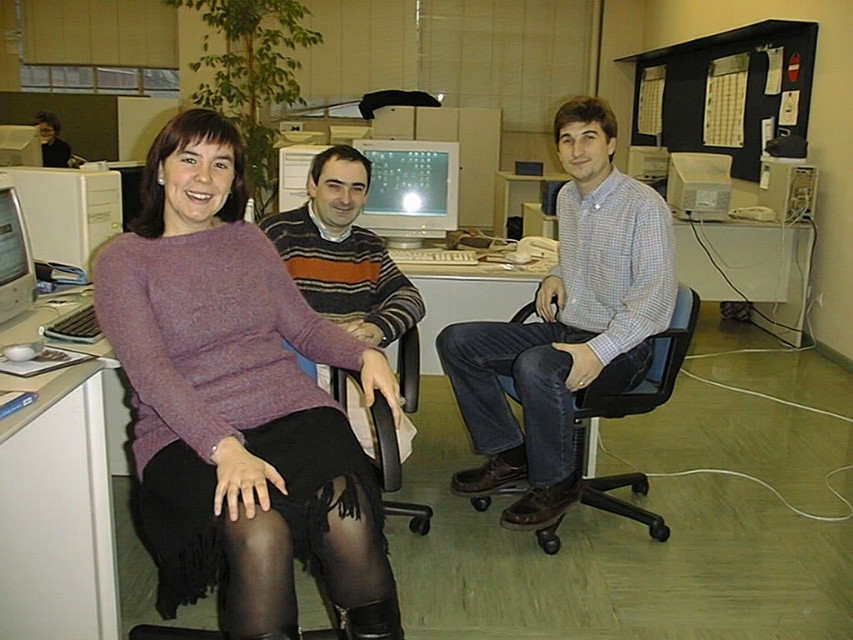
You are a delivery person who needs to place a package between the striped sweater at center and the matte plastic monitor at center. The package is 80 centimeters long. Can you fit it between them?

The striped sweater at center is 79.22 centimeters away from the matte plastic monitor at center. Since the package is 80 centimeters long, it cannot fit between them as the distance is slightly shorter than the package length.

In the scene shown: In the office scene, there are a striped sweater at center and a matte plastic monitor at center. Which object is positioned to the left of the other?

The striped sweater at center is positioned to the left of the matte plastic monitor at center.

In the office scene, there are two people wearing different lower garments. The person on the left has black tights at lower left, and the person on the right has jeans at right. Which of these lower garments is positioned more to the left side of the image?

The black tights at lower left is positioned more to the left side of the image than the jeans at right.